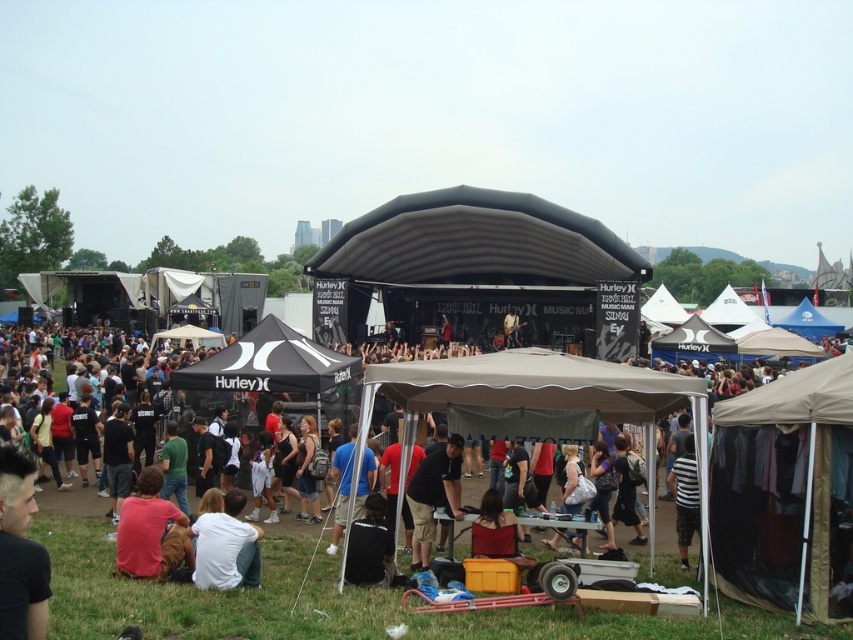
Identify the location of matte black stage at center. The width and height of the screenshot is (853, 640). (141, 394).

Is point (662, 589) positioned after point (790, 321)?

No, (662, 589) is closer to viewer.

Where is `matte black stage at center`? The height and width of the screenshot is (640, 853). matte black stage at center is located at coordinates (141, 394).

Who is more distant from viewer, (334,476) or (809,328)?

Positioned behind is point (809,328).

Can you confirm if blue fabric tent at center is positioned above blue fabric canopy at center?

Incorrect, blue fabric tent at center is not positioned above blue fabric canopy at center.

You are a GUI agent. You are given a task and a screenshot of the screen. Output one action in this format:
    pyautogui.click(x=<x>, y=<y>)
    Task: Click on the blue fabric tent at center
    
    Given the screenshot: What is the action you would take?
    pyautogui.click(x=341, y=484)

How distant is black fabric canopy at center from white cotton shirt at lower center?

black fabric canopy at center and white cotton shirt at lower center are 16.81 meters apart.

Is point (310, 380) farther from camera compared to point (219, 532)?

Yes, it is behind point (219, 532).

Find the location of a particular element. This screenshot has height=640, width=853. black fabric canopy at center is located at coordinates (270, 364).